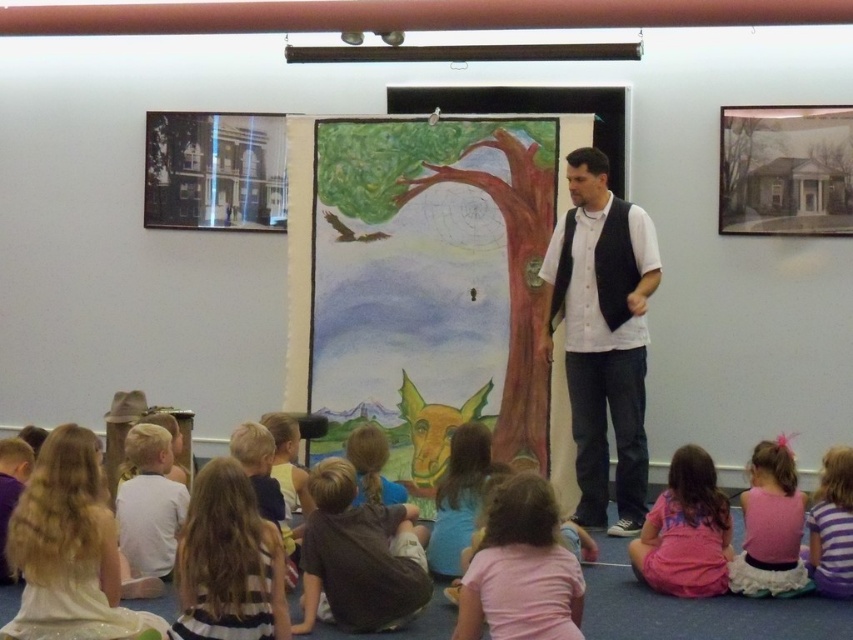
Question: Can you confirm if brown cotton shirt at lower center is positioned above pink fabric dress at lower right?

Choices:
 (A) no
 (B) yes

Answer: (A)

Question: Based on their relative distances, which object is farther from the pink fabric shirt at lower center?

Choices:
 (A) brown cotton shirt at lower center
 (B) white matte vest at center
 (C) pink fabric dress at lower right
 (D) shiny white dress at lower left

Answer: (B)

Question: In this image, where is shiny white dress at lower left located relative to striped fabric dress at lower left?

Choices:
 (A) right
 (B) left

Answer: (B)

Question: Does shiny white dress at lower left have a greater width compared to pink satin dress at lower right?

Choices:
 (A) no
 (B) yes

Answer: (B)

Question: Which object appears farthest from the camera in this image?

Choices:
 (A) striped cotton shirt at lower right
 (B) pink fabric dress at lower right
 (C) shiny white dress at lower left

Answer: (B)

Question: Based on their relative distances, which object is nearer to the pink fabric shirt at lower center?

Choices:
 (A) white matte vest at center
 (B) shiny white dress at lower left
 (C) pink fabric dress at lower right

Answer: (C)